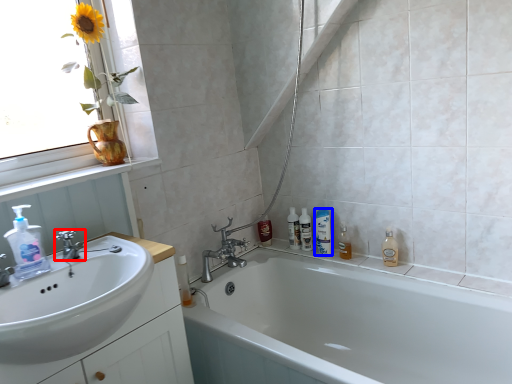
Question: Which point is further to the camera, tap (highlighted by a red box) or mouthwash (highlighted by a blue box)?

Choices:
 (A) tap
 (B) mouthwash

Answer: (B)